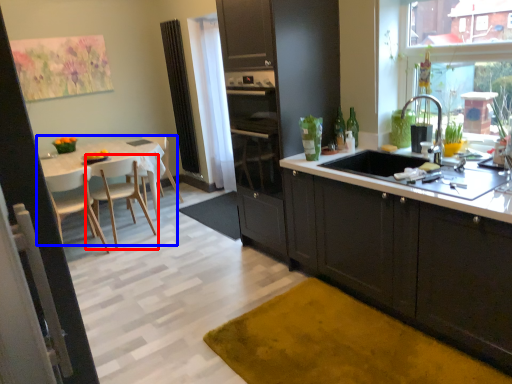
Question: Among these objects, which one is farthest to the camera, chair (highlighted by a red box) or kitchen & dining room table (highlighted by a blue box)?

Choices:
 (A) chair
 (B) kitchen & dining room table

Answer: (A)